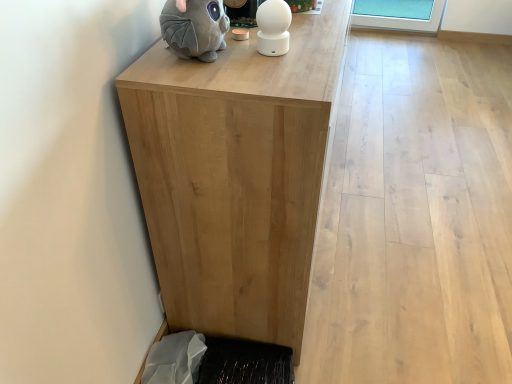
Find the location of a particular element. free space on the front side of white glossy ball at upper center is located at coordinates (276, 74).